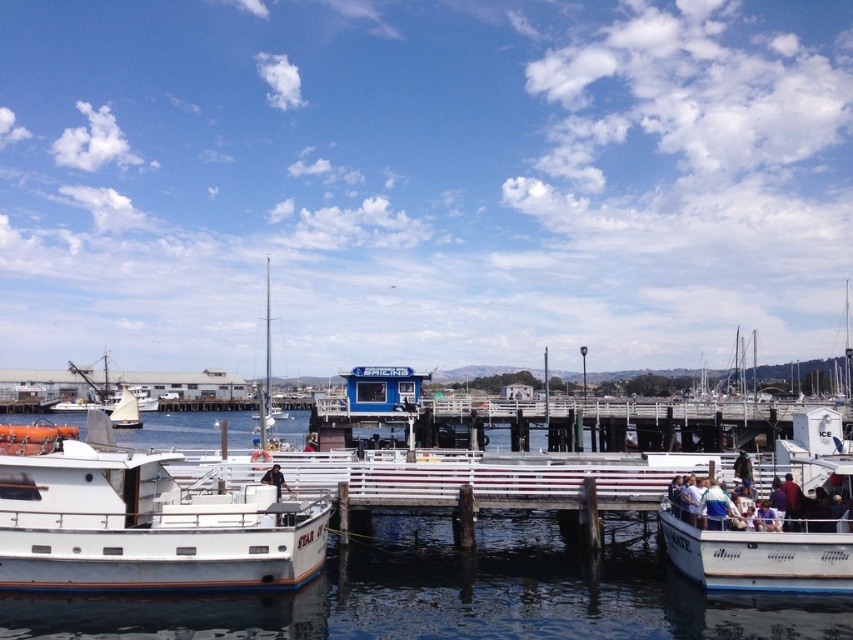
You are a photographer planning to capture a wide shot of the marina. The white glossy water at center and the white glossy boat at left are both in your frame. Based on their sizes in the image, which one appears larger?

The white glossy water at center might be wider than white glossy boat at left, so it likely appears larger in the image.

You are planning to move a large shipping container that is 10 meters wide. You see the white glossy boat at left and the white fabric people at lower right in the image. Can the container pass between them without touching either?

The white glossy boat at left is wider than the white fabric people at lower right. Since the container is 10 meters wide, it depends on the combined width of both objects. However, the exact distance between them isn

You are standing on the wooden pier at the marina and see the point marked at coordinates (456, 593). Which object from the scene is this point located on?

The point marked at coordinates (456, 593) is located on the white glossy water at center.